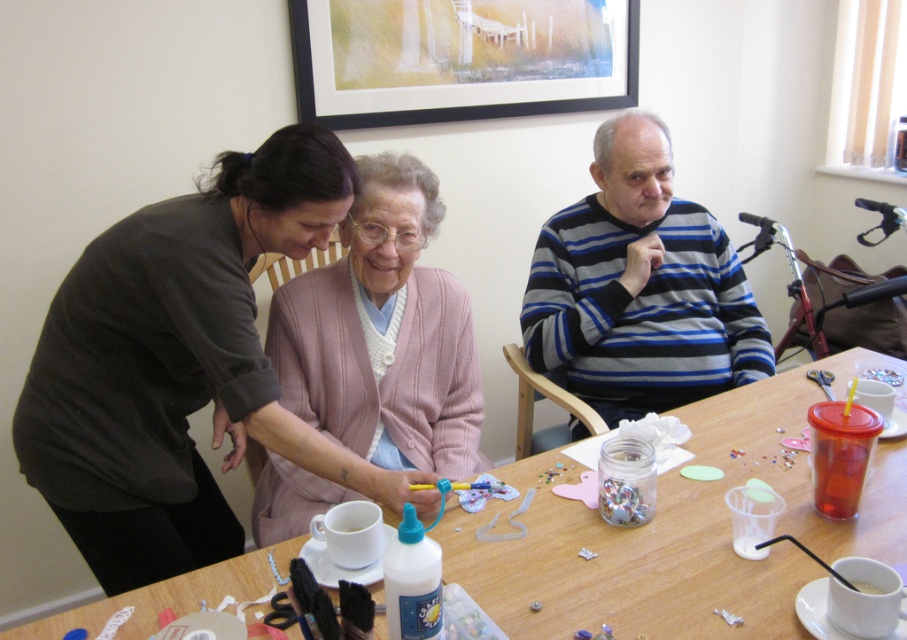
Is striped sweater at upper right to the left of wooden framed artwork at upper center from the viewer's perspective?

Incorrect, striped sweater at upper right is not on the left side of wooden framed artwork at upper center.

Which is in front, point (660, 275) or point (569, 86)?

Point (660, 275)

Is point (620, 129) closer to viewer compared to point (514, 24)?

Yes, it is in front of point (514, 24).

At what (x,y) coordinates should I click in order to perform the action: click on striped sweater at upper right. Please return your answer as a coordinate pair (x, y). This screenshot has width=907, height=640. Looking at the image, I should click on (639, 288).

Image resolution: width=907 pixels, height=640 pixels. What do you see at coordinates (181, 365) in the screenshot? I see `matte black sweater at upper left` at bounding box center [181, 365].

Between matte black sweater at upper left and striped sweater at upper right, which one is positioned lower?

matte black sweater at upper left

You are a GUI agent. You are given a task and a screenshot of the screen. Output one action in this format:
    pyautogui.click(x=<x>, y=<y>)
    Task: Click on the matte black sweater at upper left
    
    Given the screenshot: What is the action you would take?
    pyautogui.click(x=181, y=365)

Is point (225, 157) farther from viewer compared to point (434, 564)?

Yes.

What do you see at coordinates (181, 365) in the screenshot? I see `matte black sweater at upper left` at bounding box center [181, 365].

Where is `matte black sweater at upper left`? This screenshot has height=640, width=907. matte black sweater at upper left is located at coordinates (181, 365).